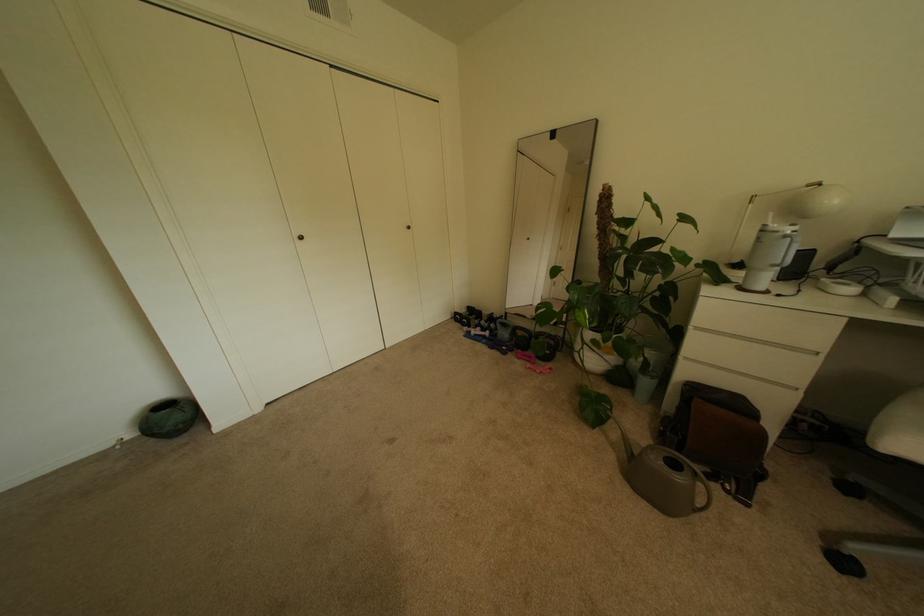
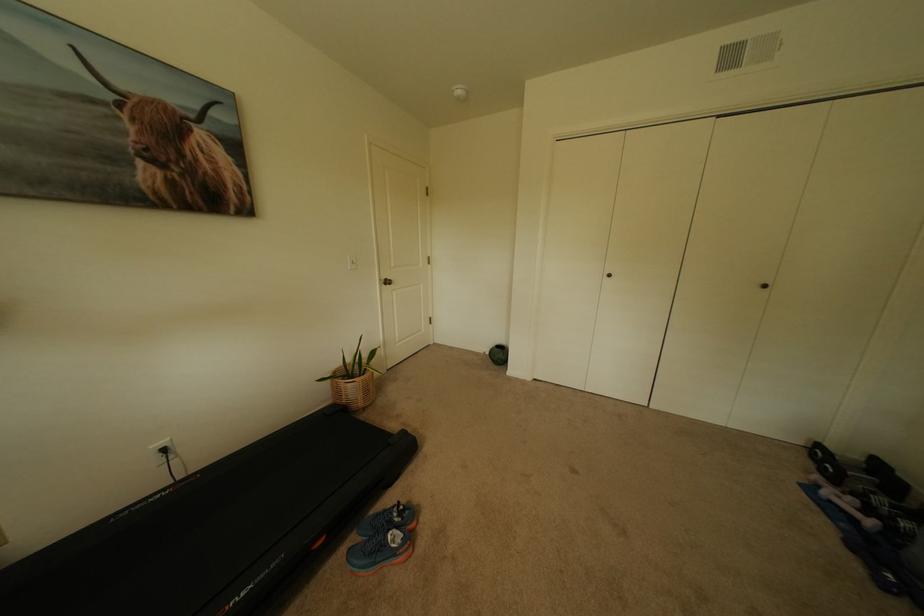
Question: Based on the continuous images, in which direction is the camera rotating? Reply with the corresponding letter.

Choices:
 (A) Left
 (B) Right
 (C) Up
 (D) Down

Answer: (A)